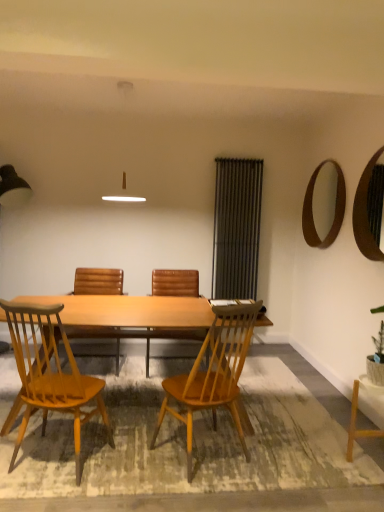
At what (x,y) coordinates should I click in order to perform the action: click on unoccupied region to the right of light brown wood chair at center, which is counted as the third chair, starting from the back. Please return your answer as a coordinate pair (x, y). The height and width of the screenshot is (512, 384). Looking at the image, I should click on (284, 459).